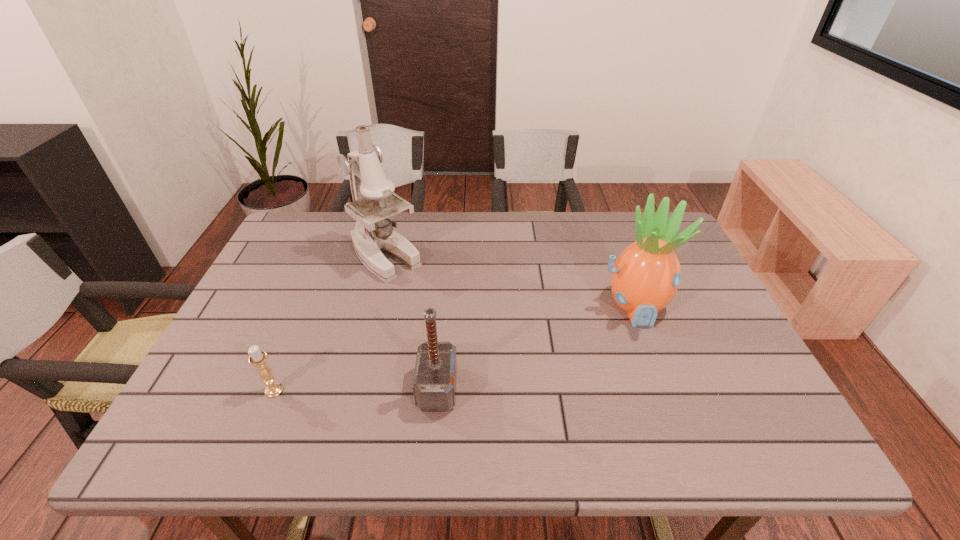
Where is `vacant space at the near right corner of the desktop`? vacant space at the near right corner of the desktop is located at coordinates (758, 441).

The height and width of the screenshot is (540, 960). Identify the location of vacant space in between the pineapple and the second shortest object. (536, 347).

You are a GUI agent. You are given a task and a screenshot of the screen. Output one action in this format:
    pyautogui.click(x=<x>, y=<y>)
    Task: Click on the vacant area that lies between the second shortest object and the shortest object
    
    Given the screenshot: What is the action you would take?
    pyautogui.click(x=356, y=389)

At what (x,y) coordinates should I click in order to perform the action: click on vacant area that lies between the candle holder and the second object from right to left. Please return your answer as a coordinate pair (x, y). Image resolution: width=960 pixels, height=540 pixels. Looking at the image, I should click on (356, 389).

You are a GUI agent. You are given a task and a screenshot of the screen. Output one action in this format:
    pyautogui.click(x=<x>, y=<y>)
    Task: Click on the empty space that is in between the third object from right to left and the pineapple
    This screenshot has width=960, height=540.
    Given the screenshot: What is the action you would take?
    pyautogui.click(x=510, y=281)

At what (x,y) coordinates should I click in order to perform the action: click on vacant area that lies between the pineapple and the hammer. Please return your answer as a coordinate pair (x, y). This screenshot has width=960, height=540. Looking at the image, I should click on (536, 347).

The width and height of the screenshot is (960, 540). Find the location of `free space that is in between the hammer and the microscope`. free space that is in between the hammer and the microscope is located at coordinates (412, 322).

I want to click on free space between the shortest object and the hammer, so click(x=356, y=389).

Where is `free space between the microscope and the second tallest object`? This screenshot has width=960, height=540. free space between the microscope and the second tallest object is located at coordinates (510, 281).

Select which object appears as the second closest to the microscope. Please provide its 2D coordinates. Your answer should be formatted as a tuple, i.e. [(x, y)], where the tuple contains the x and y coordinates of a point satisfying the conditions above.

[(258, 358)]